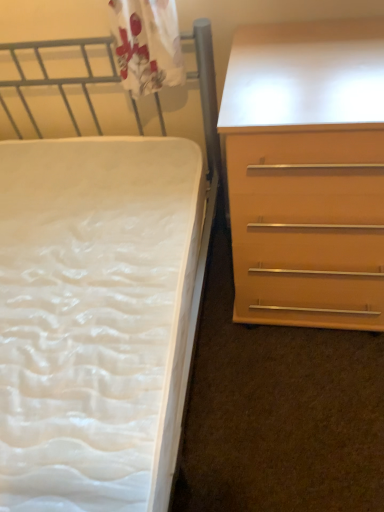
You are a GUI agent. You are given a task and a screenshot of the screen. Output one action in this format:
    pyautogui.click(x=<x>, y=<y>)
    Task: Click on the blank space situated above light brown wood chest of drawers at right (from a real-world perspective)
    
    Given the screenshot: What is the action you would take?
    pyautogui.click(x=294, y=67)